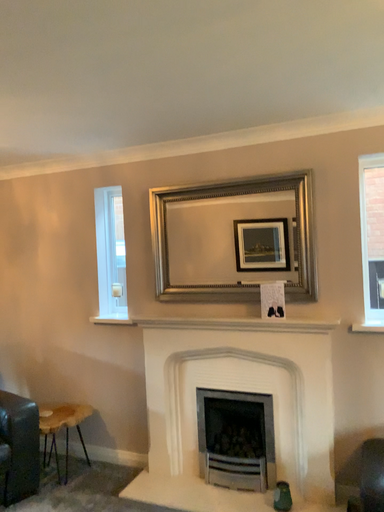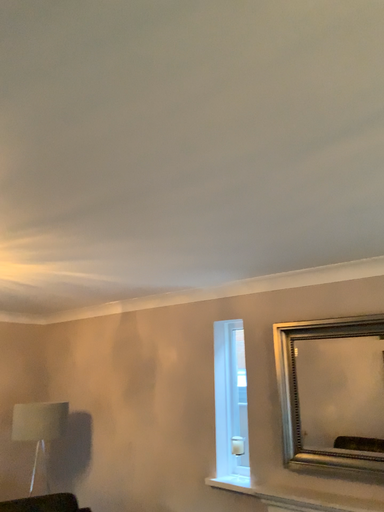
Question: Which way did the camera rotate in the video?

Choices:
 (A) rotated left
 (B) rotated right

Answer: (A)